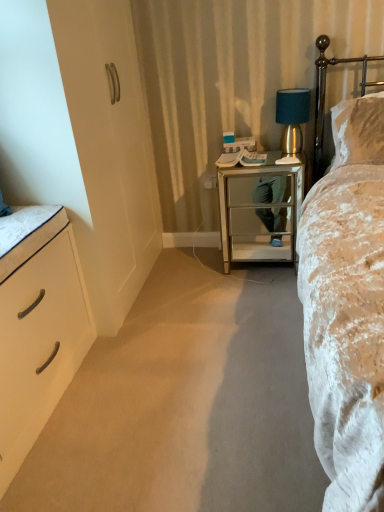
This screenshot has height=512, width=384. In order to click on free space in front of silver mirrored nightstand at center in this screenshot , I will do `click(262, 293)`.